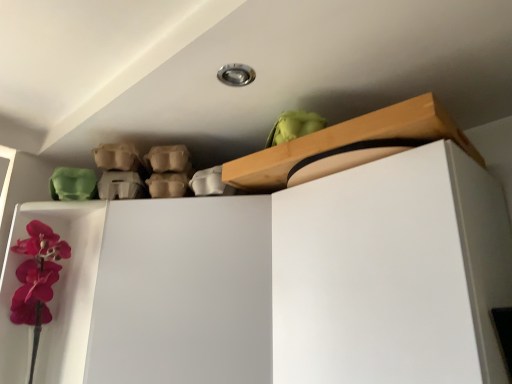
Question: Could you tell me if wooden at upper center is turned towards white matte dresser at upper center?

Choices:
 (A) yes
 (B) no

Answer: (B)

Question: Can you confirm if wooden at upper center is shorter than white matte dresser at upper center?

Choices:
 (A) no
 (B) yes

Answer: (B)

Question: From a real-world perspective, is wooden at upper center physically below white matte dresser at upper center?

Choices:
 (A) no
 (B) yes

Answer: (A)

Question: Is the surface of wooden at upper center in direct contact with white matte dresser at upper center?

Choices:
 (A) yes
 (B) no

Answer: (B)

Question: Does wooden at upper center have a larger size compared to white matte dresser at upper center?

Choices:
 (A) yes
 (B) no

Answer: (B)

Question: Considering the relative sizes of wooden at upper center and white matte dresser at upper center in the image provided, is wooden at upper center wider than white matte dresser at upper center?

Choices:
 (A) yes
 (B) no

Answer: (B)

Question: Is white matte dresser at upper center placed right next to wooden at upper center?

Choices:
 (A) no
 (B) yes

Answer: (A)

Question: Does white matte dresser at upper center have a greater height compared to wooden at upper center?

Choices:
 (A) yes
 (B) no

Answer: (A)

Question: Is white matte dresser at upper center not near wooden at upper center?

Choices:
 (A) no
 (B) yes

Answer: (A)

Question: Is white matte dresser at upper center at the left side of wooden at upper center?

Choices:
 (A) yes
 (B) no

Answer: (A)

Question: From a real-world perspective, is white matte dresser at upper center under wooden at upper center?

Choices:
 (A) no
 (B) yes

Answer: (B)

Question: Considering the relative sizes of white matte dresser at upper center and wooden at upper center in the image provided, is white matte dresser at upper center bigger than wooden at upper center?

Choices:
 (A) no
 (B) yes

Answer: (B)

Question: From the image's perspective, is white matte dresser at upper center positioned above or below wooden at upper center?

Choices:
 (A) below
 (B) above

Answer: (A)